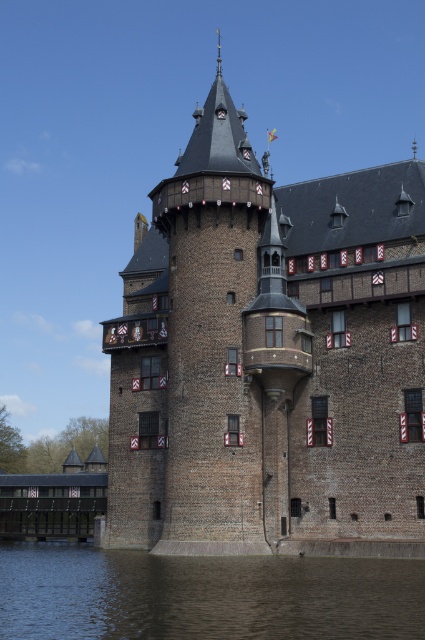
Image resolution: width=425 pixels, height=640 pixels. Describe the element at coordinates (269, 358) in the screenshot. I see `brown brick castle at center` at that location.

Which is behind, point (231, 157) or point (357, 600)?

Positioned behind is point (231, 157).

The image size is (425, 640). Identify the location of brown brick castle at center. (269, 358).

Where is `brown brick castle at center`? brown brick castle at center is located at coordinates (269, 358).